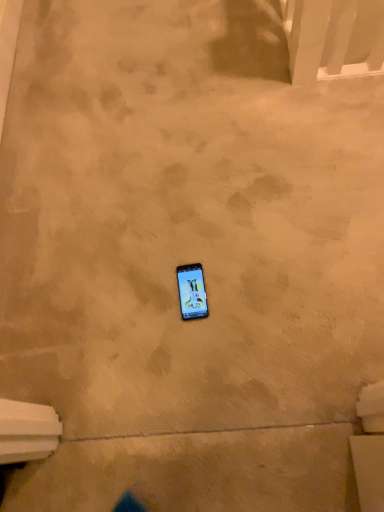
Where is `free spot behind matte black phone at center`? The height and width of the screenshot is (512, 384). free spot behind matte black phone at center is located at coordinates (179, 241).